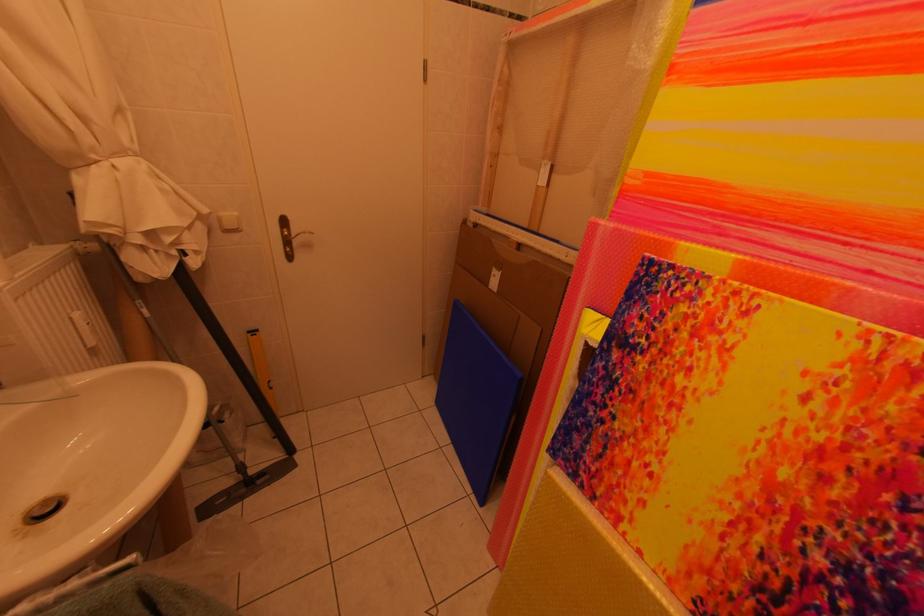
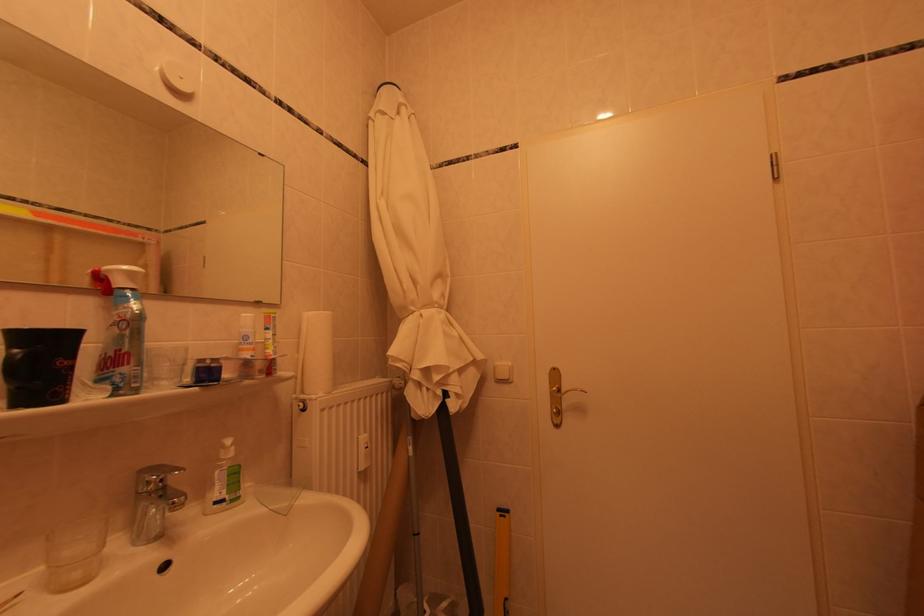
Locate, in the second image, the point that corresponds to pixel 229 217 in the first image.

(506, 367)